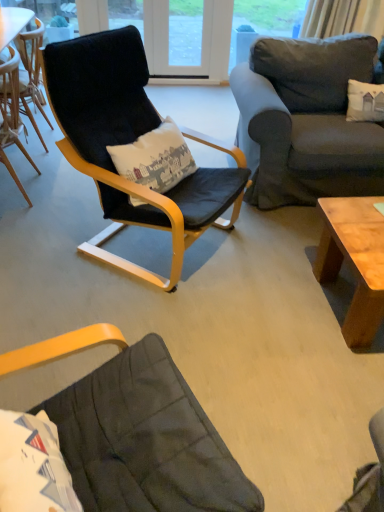
Question: From the image's perspective, is wooden chair at left, the second chair in the right-to-left sequence, beneath dark gray fabric couch at upper right?

Choices:
 (A) yes
 (B) no

Answer: (A)

Question: From the image's perspective, is wooden chair at left, the second chair in the right-to-left sequence, on dark gray fabric couch at upper right?

Choices:
 (A) no
 (B) yes

Answer: (A)

Question: Does wooden chair at left, the second chair in the right-to-left sequence, appear on the right side of dark gray fabric couch at upper right?

Choices:
 (A) yes
 (B) no

Answer: (B)

Question: Is wooden chair at left, which is counted as the first chair, starting from the left, turned away from dark gray fabric couch at upper right?

Choices:
 (A) yes
 (B) no

Answer: (A)

Question: Does wooden chair at left, the second chair in the right-to-left sequence, have a lesser height compared to dark gray fabric couch at upper right?

Choices:
 (A) no
 (B) yes

Answer: (B)

Question: From the image's perspective, is velvet black armchair at center, placed as the first chair when sorted from right to left, positioned above or below wooden chair at left, which is counted as the first chair, starting from the left?

Choices:
 (A) below
 (B) above

Answer: (A)

Question: Considering the positions of velvet black armchair at center, placed as the first chair when sorted from right to left, and wooden chair at left, which is counted as the first chair, starting from the left, in the image, is velvet black armchair at center, placed as the first chair when sorted from right to left, bigger or smaller than wooden chair at left, which is counted as the first chair, starting from the left,?

Choices:
 (A) small
 (B) big

Answer: (B)

Question: From a real-world perspective, is velvet black armchair at center, placed as the first chair when sorted from right to left, physically located above or below wooden chair at left, which is counted as the first chair, starting from the left?

Choices:
 (A) above
 (B) below

Answer: (A)

Question: In terms of height, does velvet black armchair at center, the second chair in the left-to-right sequence, look taller or shorter compared to wooden chair at left, which is counted as the first chair, starting from the left?

Choices:
 (A) tall
 (B) short

Answer: (A)

Question: In the image, is velvet black armchair at center, the second chair in the left-to-right sequence, on the left side or the right side of dark gray fabric couch at upper right?

Choices:
 (A) left
 (B) right

Answer: (A)

Question: Do you think velvet black armchair at center, placed as the first chair when sorted from right to left, is within dark gray fabric couch at upper right, or outside of it?

Choices:
 (A) inside
 (B) outside

Answer: (B)

Question: In the image, is velvet black armchair at center, placed as the first chair when sorted from right to left, positioned in front of or behind dark gray fabric couch at upper right?

Choices:
 (A) behind
 (B) front

Answer: (B)

Question: Considering the positions of velvet black armchair at center, the second chair in the left-to-right sequence, and dark gray fabric couch at upper right in the image, is velvet black armchair at center, the second chair in the left-to-right sequence, wider or thinner than dark gray fabric couch at upper right?

Choices:
 (A) wide
 (B) thin

Answer: (B)

Question: From the image's perspective, is light brown wood coffee table at lower right located above or below dark gray fabric couch at upper right?

Choices:
 (A) below
 (B) above

Answer: (A)

Question: Considering the relative positions of light brown wood coffee table at lower right and dark gray fabric couch at upper right in the image provided, is light brown wood coffee table at lower right to the left or to the right of dark gray fabric couch at upper right?

Choices:
 (A) right
 (B) left

Answer: (B)